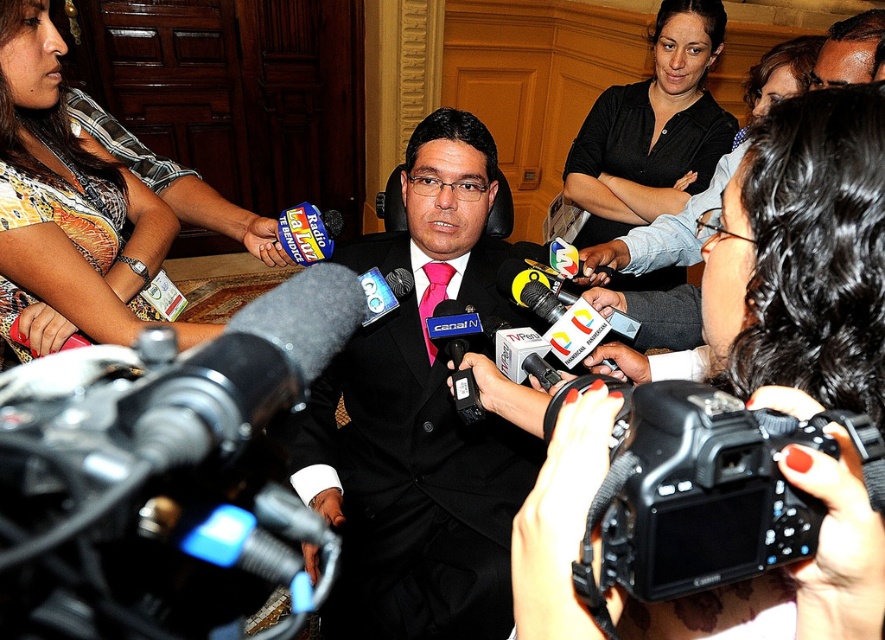
Question: Which of the following is the farthest from the observer?

Choices:
 (A) [x=343, y=577]
 (B) [x=618, y=92]
 (C) [x=216, y=406]

Answer: (B)

Question: Which object is the farthest from the printed fabric blouse at upper left?

Choices:
 (A) black suit at center
 (B) black matte shirt at center
 (C) black matte microphone at center
 (D) black plastic camera at center

Answer: (B)

Question: Which point is farther from the camera taking this photo?

Choices:
 (A) (27, 58)
 (B) (258, 362)

Answer: (A)

Question: Is black suit at center positioned at the back of black matte shirt at center?

Choices:
 (A) no
 (B) yes

Answer: (A)

Question: Is black plastic camera at center below black matte shirt at center?

Choices:
 (A) yes
 (B) no

Answer: (A)

Question: Can you confirm if black suit at center is positioned below black matte microphone at center?

Choices:
 (A) no
 (B) yes

Answer: (B)